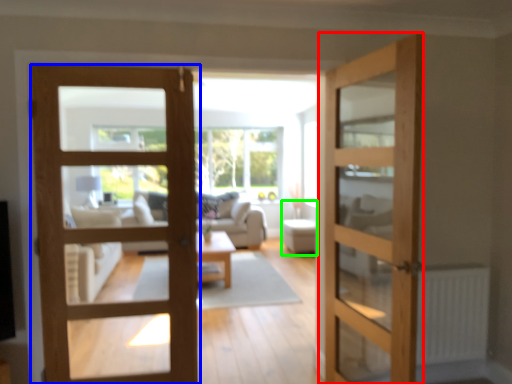
Question: Which is nearer to the door (highlighted by a red box)? door (highlighted by a blue box) or furniture (highlighted by a green box).

Choices:
 (A) door
 (B) furniture

Answer: (A)